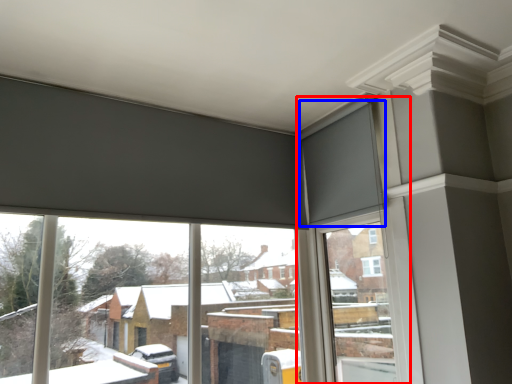
Question: Which of the following is the closest to the observer, window frame (highlighted by a red box) or curtain (highlighted by a blue box)?

Choices:
 (A) window frame
 (B) curtain

Answer: (A)